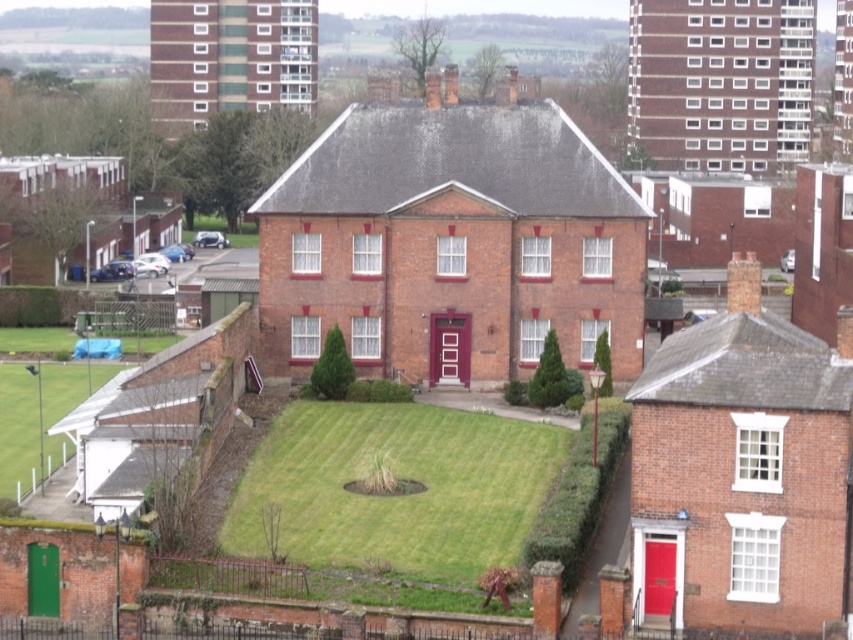
You are a landscape architect designing a new garden for the brick house. You need to choose the area with more space to plant a large tree. Which area has more space between the green grass at center and the green grass at lower left?

The green grass at lower left has more space than the green grass at center, so you should choose the green grass at lower left to plant the large tree.

You are a gardener who wants to ensure the lawn is even. You notice two areas of green grass at center and green grass at lower left. Which area might need mowing based on their heights?

The green grass at center has a lesser height compared to green grass at lower left, so the green grass at lower left might need mowing since it is taller.